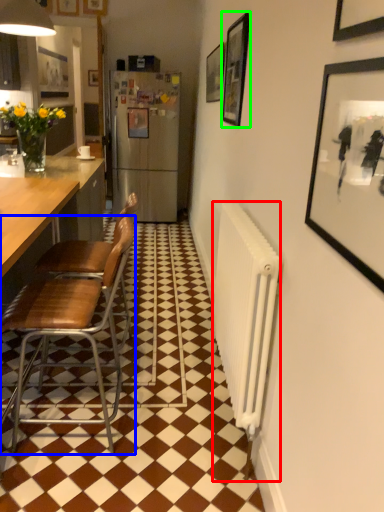
Question: Which is farther away from radiator (highlighted by a red box)? chair (highlighted by a blue box) or picture frame (highlighted by a green box)?

Choices:
 (A) chair
 (B) picture frame

Answer: (B)